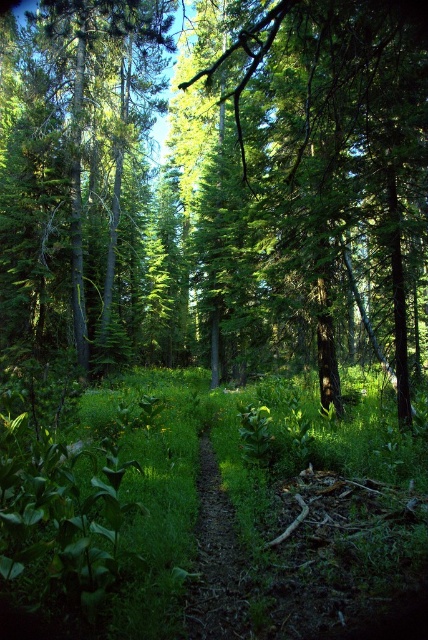
You are standing on the dirt path in the forest and see the green leafy grass at center and the green leafy tree at center. Which one is closer to you?

The green leafy grass at center is closer to you because it is further to the viewer than the green leafy tree at center.

You are a hiker walking along the dirt path at center in the forest. You notice a green leafy tree at center in front of you. Is the tree blocking your path or is it behind the path?

The green leafy tree at center is behind the dirt path at center, so it is not blocking your path.